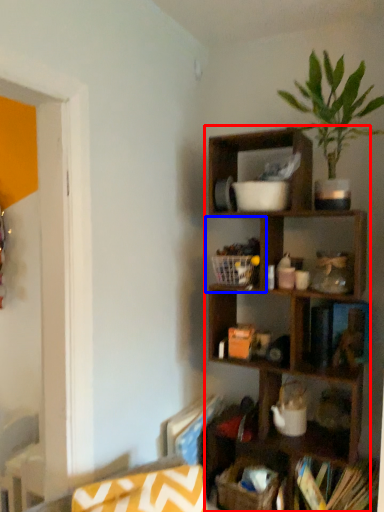
Question: Among these objects, which one is nearest to the camera, shelf (highlighted by a red box) or cabinet (highlighted by a blue box)?

Choices:
 (A) shelf
 (B) cabinet

Answer: (A)